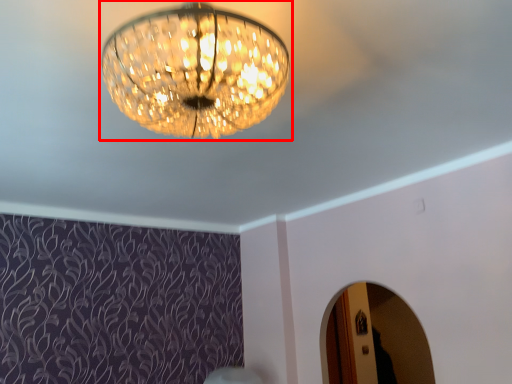
Question: From the image's perspective, where is lamp (annotated by the red box) located relative to mirror?

Choices:
 (A) below
 (B) above

Answer: (B)